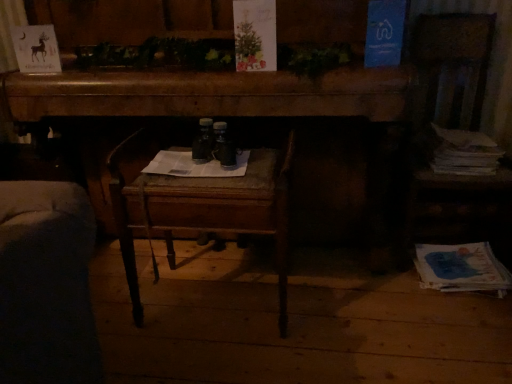
Find the location of a particular element. The width and height of the screenshot is (512, 384). free point below wooden chair at center (from a real-world perspective) is located at coordinates [217, 309].